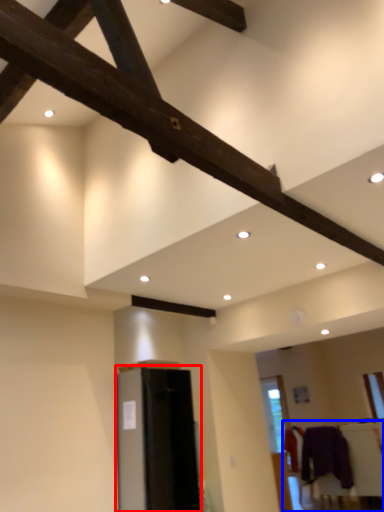
Question: Which point is further to the camera, furniture (highlighted by a red box) or furniture (highlighted by a blue box)?

Choices:
 (A) furniture
 (B) furniture

Answer: (B)